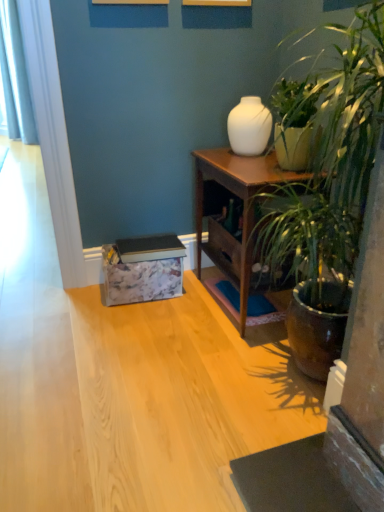
Question: Is wooden nightstand at center-right next to white glossy vase at upper center?

Choices:
 (A) no
 (B) yes

Answer: (A)

Question: From a real-world perspective, is wooden nightstand at center-right physically below white glossy vase at upper center?

Choices:
 (A) no
 (B) yes

Answer: (B)

Question: Is wooden nightstand at center-right wider than white glossy vase at upper center?

Choices:
 (A) no
 (B) yes

Answer: (B)

Question: Is wooden nightstand at center-right outside white glossy vase at upper center?

Choices:
 (A) yes
 (B) no

Answer: (A)

Question: Is wooden nightstand at center-right at the right side of white glossy vase at upper center?

Choices:
 (A) no
 (B) yes

Answer: (B)

Question: Looking at their shapes, would you say white glossy vase at upper center is wider or thinner than white fabric curtain at left?

Choices:
 (A) thin
 (B) wide

Answer: (A)

Question: Based on their positions, is white glossy vase at upper center located to the left or right of white fabric curtain at left?

Choices:
 (A) right
 (B) left

Answer: (A)

Question: In terms of height, does white glossy vase at upper center look taller or shorter compared to white fabric curtain at left?

Choices:
 (A) short
 (B) tall

Answer: (A)

Question: Is white glossy vase at upper center inside the boundaries of white fabric curtain at left, or outside?

Choices:
 (A) outside
 (B) inside

Answer: (A)

Question: Which is correct: green leafy plant at right is inside wooden nightstand at center-right, or outside of it?

Choices:
 (A) inside
 (B) outside

Answer: (B)

Question: Considering their positions, is green leafy plant at right located in front of or behind wooden nightstand at center-right?

Choices:
 (A) front
 (B) behind

Answer: (A)

Question: Looking at the image, does green leafy plant at right seem bigger or smaller compared to wooden nightstand at center-right?

Choices:
 (A) small
 (B) big

Answer: (B)

Question: From a real-world perspective, is green leafy plant at right physically located above or below wooden nightstand at center-right?

Choices:
 (A) below
 (B) above

Answer: (B)

Question: Relative to wooden nightstand at center-right, is white fabric curtain at left in front or behind?

Choices:
 (A) behind
 (B) front

Answer: (A)

Question: From a real-world perspective, is white fabric curtain at left physically located above or below wooden nightstand at center-right?

Choices:
 (A) below
 (B) above

Answer: (B)